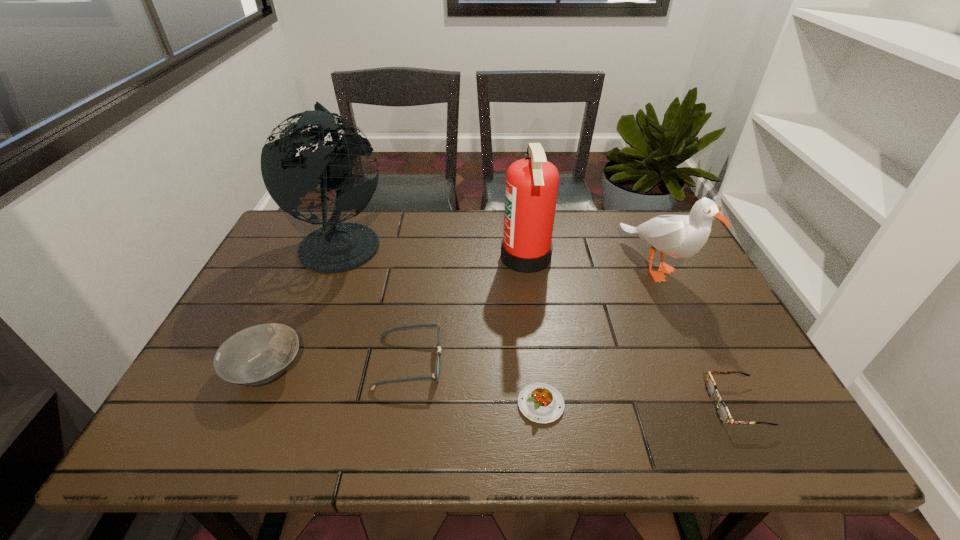
The image size is (960, 540). What are the coordinates of `fire extinguisher at the far edge` in the screenshot? It's located at (531, 189).

Locate an element on the screen. The height and width of the screenshot is (540, 960). gull that is at the far edge is located at coordinates (680, 236).

You are a GUI agent. You are given a task and a screenshot of the screen. Output one action in this format:
    pyautogui.click(x=<x>, y=<y>)
    Task: Click on the spectacles that is positioned at the near edge
    The width and height of the screenshot is (960, 540).
    Given the screenshot: What is the action you would take?
    pyautogui.click(x=723, y=413)

The height and width of the screenshot is (540, 960). What are the coordinates of `pudding located in the near edge section of the desktop` in the screenshot? It's located at (539, 402).

The image size is (960, 540). Find the location of `globe present at the left edge`. globe present at the left edge is located at coordinates (336, 247).

The height and width of the screenshot is (540, 960). Identify the location of bowl that is at the left edge. (259, 354).

Where is `gull situated at the right edge`? This screenshot has height=540, width=960. gull situated at the right edge is located at coordinates (680, 236).

Where is `spectacles at the right edge`? spectacles at the right edge is located at coordinates (723, 413).

Where is `object present at the far left corner`? This screenshot has width=960, height=540. object present at the far left corner is located at coordinates (336, 247).

Where is `object that is at the far right corner`? The image size is (960, 540). object that is at the far right corner is located at coordinates (680, 236).